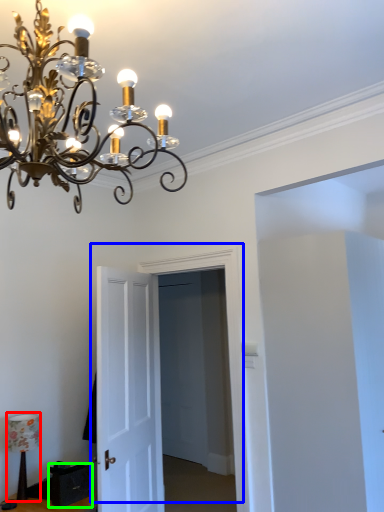
Question: Estimate the real-world distances between objects in this image. Which object is closer to lamp (highlighted by a red box), door (highlighted by a blue box) or drawer (highlighted by a green box)?

Choices:
 (A) door
 (B) drawer

Answer: (B)